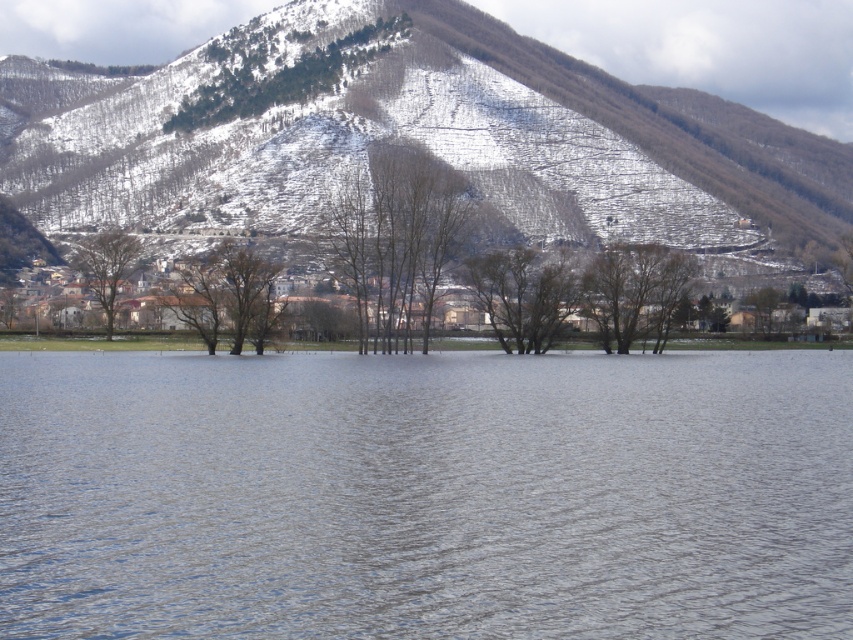
You are an environmental scientist assessing the flood risk in this area. You notice the snowy forested mountain at center and the brown matte tree at center. Which object would you prioritize studying to determine the potential impact of rising water levels on the local ecosystem? Explain your reasoning.

The snowy forested mountain at center has a larger width than the brown matte tree at center, making it a more significant geographical feature. This suggests it could contribute more to water runoff or snowmelt, which are critical factors in assessing flood risks and their impact on the local ecosystem.

You are a hiker planning to take a photo of both the snowy forested mountain at center and the brown matte tree at center. Which object should you focus on first if you want to capture both in a single frame without moving your camera?

You should focus on the snowy forested mountain at center first because it is taller than the brown matte tree at center, allowing you to frame both objects effectively by adjusting the camera angle to include both the taller mountain and the shorter tree in the composition.

You are a hiker standing at the camera position in the image. You want to reach the snowy forested mountain at center for a snowboarding trip. Considering the distance, is it feasible to hike there in a single day?

The distance between the snowy forested mountain at center and the camera is 375.06 meters. Given that this is a relatively short distance, it is feasible to hike there in a single day.